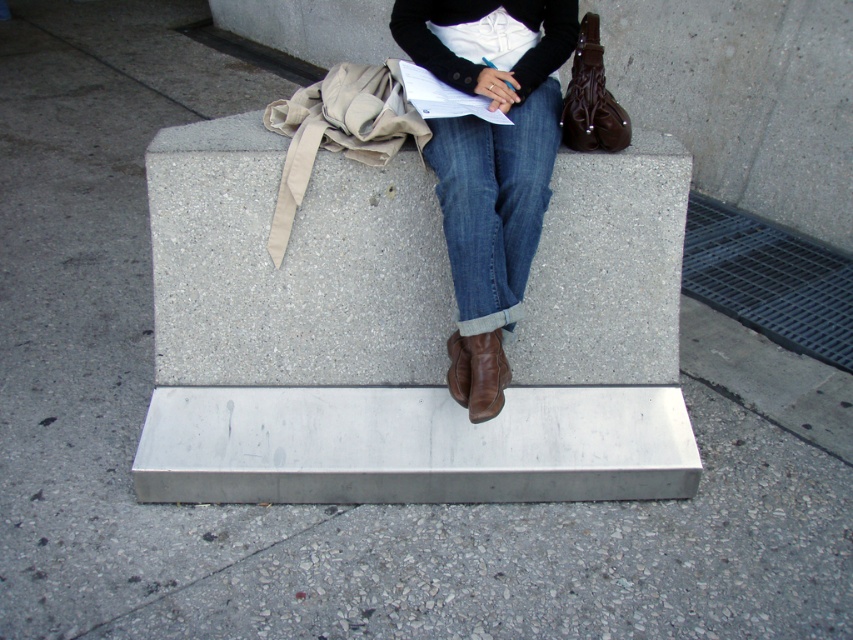
You are a person who is 1.7 meters tall and want to sit on the gray concrete bench at center. Can you comfortably sit on it without needing to move closer or farther away?

The gray concrete bench at center is 1.96 meters away from the viewer. Since the average comfortable sitting distance for a person of 1.7 meters height is typically around 1.5 to 1.8 meters, the distance is slightly beyond the comfortable range. Therefore, you might need to move a bit closer to sit comfortably.

You are standing at the origin point of the image coordinate system. The gray concrete bench at center is located at point (404, 333). If you want to walk towards the gray concrete bench at center, which direction should you move in terms of the x and y axes?

To reach the gray concrete bench at center located at point (404, 333), you should move in the positive x and positive y direction since the coordinates are both greater than zero.